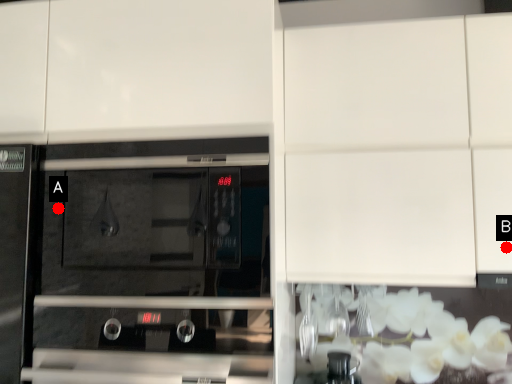
Question: Two points are circled on the image, labeled by A and B beside each circle. Which point is further to the camera?

Choices:
 (A) A is further
 (B) B is further

Answer: (B)